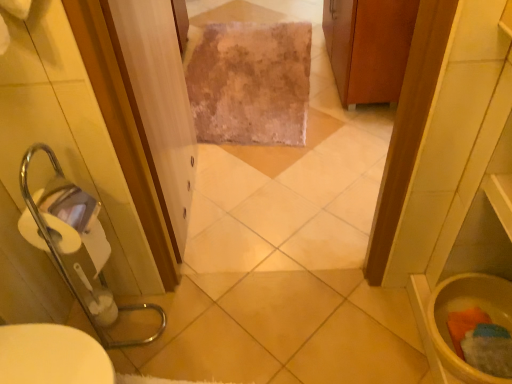
Question: Is there a large distance between clear plastic screen door at center and yellow matte toilet bowl at lower right?

Choices:
 (A) yes
 (B) no

Answer: (A)

Question: From the image's perspective, is clear plastic screen door at center under yellow matte toilet bowl at lower right?

Choices:
 (A) no
 (B) yes

Answer: (A)

Question: Can you confirm if clear plastic screen door at center is thinner than yellow matte toilet bowl at lower right?

Choices:
 (A) no
 (B) yes

Answer: (B)

Question: Is clear plastic screen door at center further to camera compared to yellow matte toilet bowl at lower right?

Choices:
 (A) yes
 (B) no

Answer: (B)

Question: From a real-world perspective, is clear plastic screen door at center physically below yellow matte toilet bowl at lower right?

Choices:
 (A) yes
 (B) no

Answer: (B)

Question: Considering the positions of point (371, 86) and point (172, 119), is point (371, 86) closer or farther from the camera than point (172, 119)?

Choices:
 (A) farther
 (B) closer

Answer: (A)

Question: In the image, is wooden cabinet at upper right positioned in front of or behind clear plastic screen door at center?

Choices:
 (A) behind
 (B) front

Answer: (A)

Question: Considering the positions of wooden cabinet at upper right and clear plastic screen door at center in the image, is wooden cabinet at upper right taller or shorter than clear plastic screen door at center?

Choices:
 (A) tall
 (B) short

Answer: (B)

Question: Do you think wooden cabinet at upper right is within clear plastic screen door at center, or outside of it?

Choices:
 (A) inside
 (B) outside

Answer: (B)

Question: Is wooden cabinet at upper right inside the boundaries of fuzzy beige rug at center, or outside?

Choices:
 (A) inside
 (B) outside

Answer: (B)

Question: Is point (362, 61) closer or farther from the camera than point (256, 104)?

Choices:
 (A) closer
 (B) farther

Answer: (A)

Question: Is wooden cabinet at upper right wider or thinner than fuzzy beige rug at center?

Choices:
 (A) thin
 (B) wide

Answer: (A)

Question: Is wooden cabinet at upper right bigger or smaller than fuzzy beige rug at center?

Choices:
 (A) small
 (B) big

Answer: (B)

Question: Based on their positions, is wooden cabinet at upper right located to the left or right of yellow matte toilet bowl at lower right?

Choices:
 (A) left
 (B) right

Answer: (A)

Question: Based on their sizes in the image, would you say wooden cabinet at upper right is bigger or smaller than yellow matte toilet bowl at lower right?

Choices:
 (A) small
 (B) big

Answer: (B)